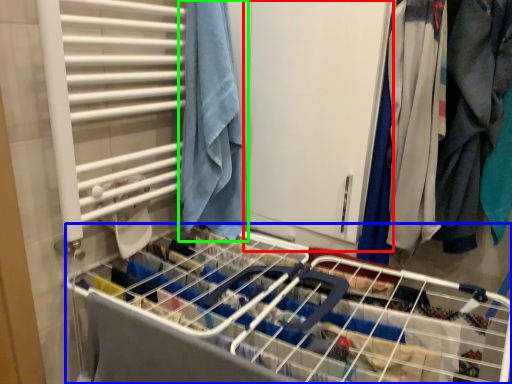
Question: Which is nearer to the screen door (highlighted by a red box)? bed frame (highlighted by a blue box) or towel (highlighted by a green box).

Choices:
 (A) bed frame
 (B) towel

Answer: (B)